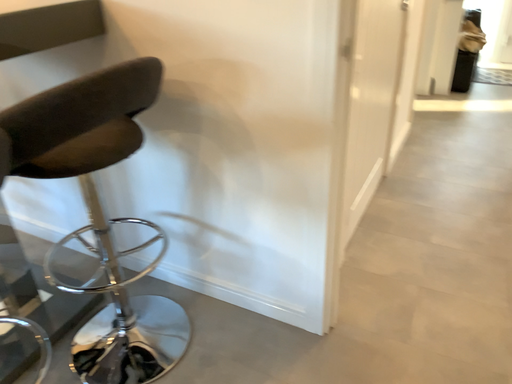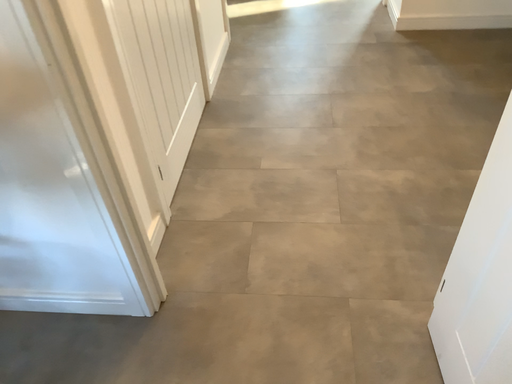
Question: How did the camera likely rotate when shooting the video?

Choices:
 (A) rotated upward
 (B) rotated downward

Answer: (B)